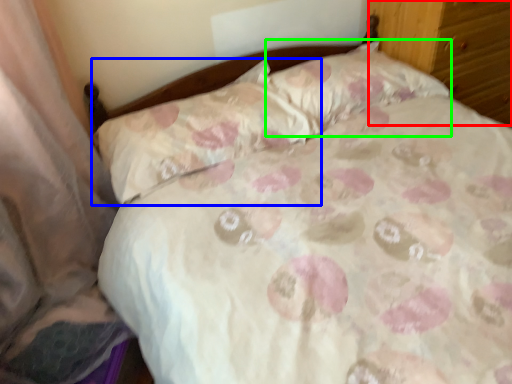
Question: Which is farther away from dresser (highlighted by a red box)? pillow (highlighted by a blue box) or pillow (highlighted by a green box)?

Choices:
 (A) pillow
 (B) pillow

Answer: (A)